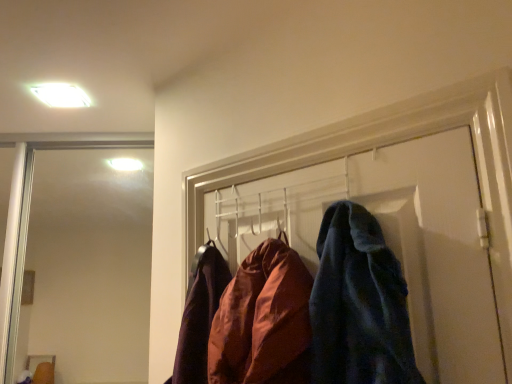
Question: Considering the positions of velvety blue coat at center and white glossy light fixture at upper left in the image, is velvety blue coat at center taller or shorter than white glossy light fixture at upper left?

Choices:
 (A) tall
 (B) short

Answer: (A)

Question: Is velvety blue coat at center bigger or smaller than white glossy light fixture at upper left?

Choices:
 (A) small
 (B) big

Answer: (B)

Question: From a real-world perspective, is velvety blue coat at center physically located above or below white glossy light fixture at upper left?

Choices:
 (A) below
 (B) above

Answer: (A)

Question: In the image, is white glossy light fixture at upper left on the left side or the right side of velvety blue coat at center?

Choices:
 (A) right
 (B) left

Answer: (B)

Question: From their relative heights in the image, would you say white glossy light fixture at upper left is taller or shorter than velvety blue coat at center?

Choices:
 (A) short
 (B) tall

Answer: (A)

Question: Considering the positions of white glossy light fixture at upper left and velvety blue coat at center in the image, is white glossy light fixture at upper left bigger or smaller than velvety blue coat at center?

Choices:
 (A) small
 (B) big

Answer: (A)

Question: Does point (53, 104) appear closer or farther from the camera than point (416, 347)?

Choices:
 (A) farther
 (B) closer

Answer: (A)